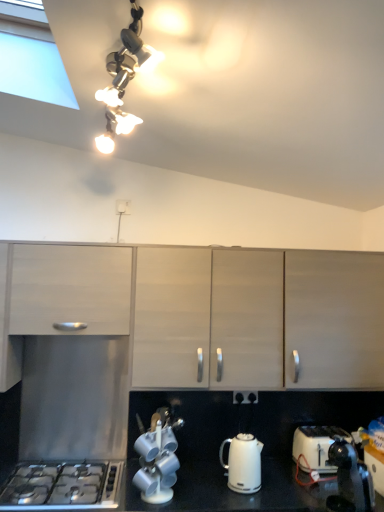
Question: In the image, is matte wood cabinets at center, placed as the 1th cabinetry when sorted from right to left, positioned in front of or behind white glossy electric kettle at lower center?

Choices:
 (A) front
 (B) behind

Answer: (B)

Question: In terms of size, does matte wood cabinets at center, placed as the 1th cabinetry when sorted from right to left, appear bigger or smaller than white glossy electric kettle at lower center?

Choices:
 (A) small
 (B) big

Answer: (B)

Question: Which object is the closest to the white glossy electric kettle at lower center?

Choices:
 (A) metallic silver tea set at lower center
 (B) white plastic electric outlet at center, the second electric outlet viewed from the right
 (C) stainless steel gas stove at lower left
 (D) black plastic electric outlet at center, which appears as the 2th electric outlet when viewed from the left
 (E) metallic chain lights at upper center

Answer: (D)

Question: Estimate the real-world distances between objects in this image. Which object is farther from the white glossy electric kettle at lower center?

Choices:
 (A) stainless steel gas stove at lower left
 (B) metallic silver tea set at lower center
 (C) metallic chain lights at upper center
 (D) matte wood cabinet at left, which is the 2th cabinetry in right-to-left order
 (E) matte wood cabinets at center, which is the 2th cabinetry in left-to-right order

Answer: (C)